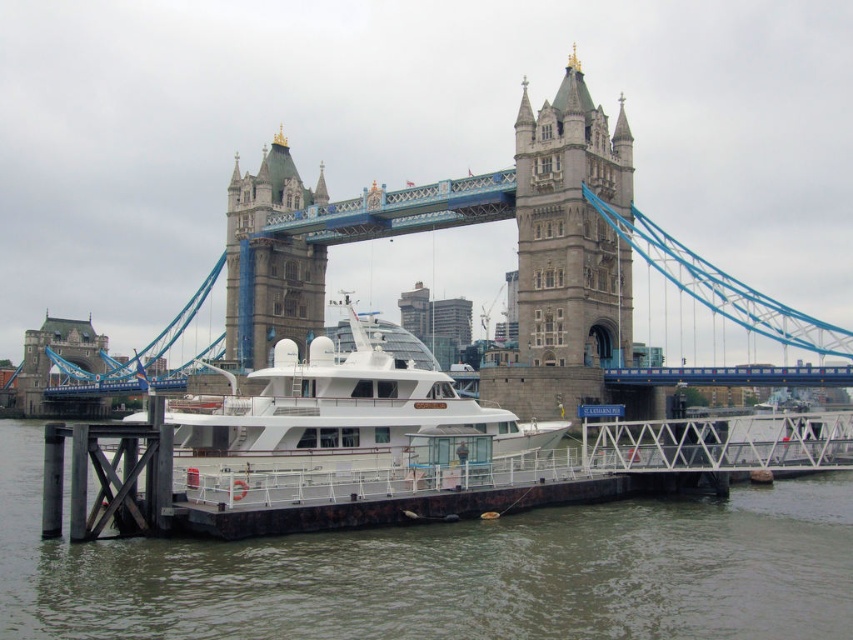
You are a photographer planning to take a photo of the Tower Bridge in London. You have a drone that can fly up to 50 meters high. The brown water at lower center and the white glossy boat at center are in your shot. Considering their heights, can your drone capture both objects in the same frame without needing to adjust its altitude?

The brown water at lower center has a lesser height compared to the white glossy boat at center. Since the drone can fly up to 50 meters, it should be able to capture both objects in the same frame as the height difference between them is not significant enough to require altitude adjustment.